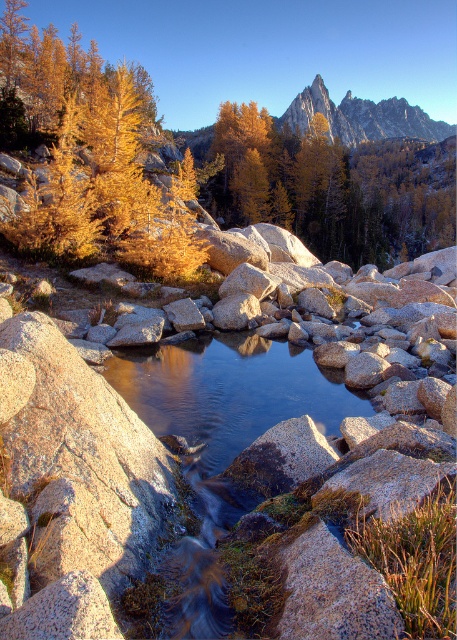
Question: In this image, where is golden larch tree at upper left located relative to sharp granite peak at upper center?

Choices:
 (A) left
 (B) right

Answer: (A)

Question: Is golden larch tree at upper left wider than sharp granite peak at upper center?

Choices:
 (A) no
 (B) yes

Answer: (A)

Question: Can you confirm if golden larch tree at upper left is smaller than sharp granite peak at upper center?

Choices:
 (A) yes
 (B) no

Answer: (A)

Question: Which point appears closest to the camera in this image?

Choices:
 (A) (345, 120)
 (B) (54, 116)

Answer: (B)

Question: Which of the following is the closest to the observer?

Choices:
 (A) (137, 72)
 (B) (355, 124)

Answer: (A)